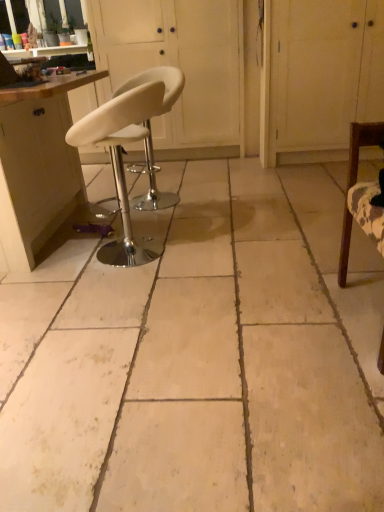
You are a GUI agent. You are given a task and a screenshot of the screen. Output one action in this format:
    pyautogui.click(x=<x>, y=<y>)
    Task: Click on the free space in front of white leather stool at center, acting as the 1th chair starting from the left
    
    Given the screenshot: What is the action you would take?
    pyautogui.click(x=127, y=295)